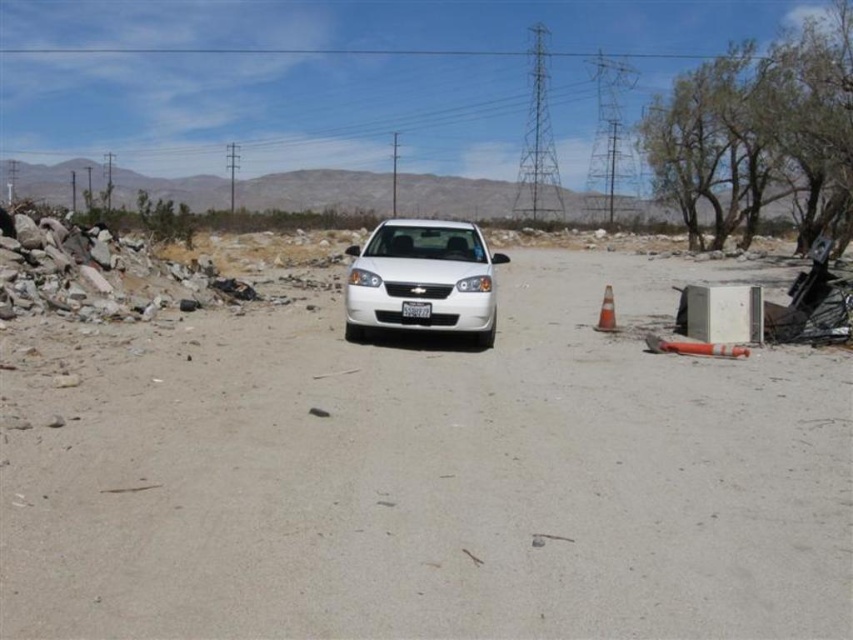
Question: Is white glossy sedan at center positioned in front of white plastic license plate at center?

Choices:
 (A) yes
 (B) no

Answer: (B)

Question: Which point is closer to the camera?

Choices:
 (A) tap(416, 307)
 (B) tap(248, 499)
 (C) tap(602, 330)

Answer: (B)

Question: Is white glossy sedan at center behind white plastic license plate at center?

Choices:
 (A) no
 (B) yes

Answer: (B)

Question: Is white glossy sedan at center bigger than orange reflective cone at right?

Choices:
 (A) yes
 (B) no

Answer: (A)

Question: Which point appears closest to the camera in this image?

Choices:
 (A) (457, 289)
 (B) (418, 305)

Answer: (B)

Question: Based on their relative distances, which object is nearer to the white glossy sedan at center?

Choices:
 (A) orange reflective cone at right
 (B) white plastic license plate at center

Answer: (B)